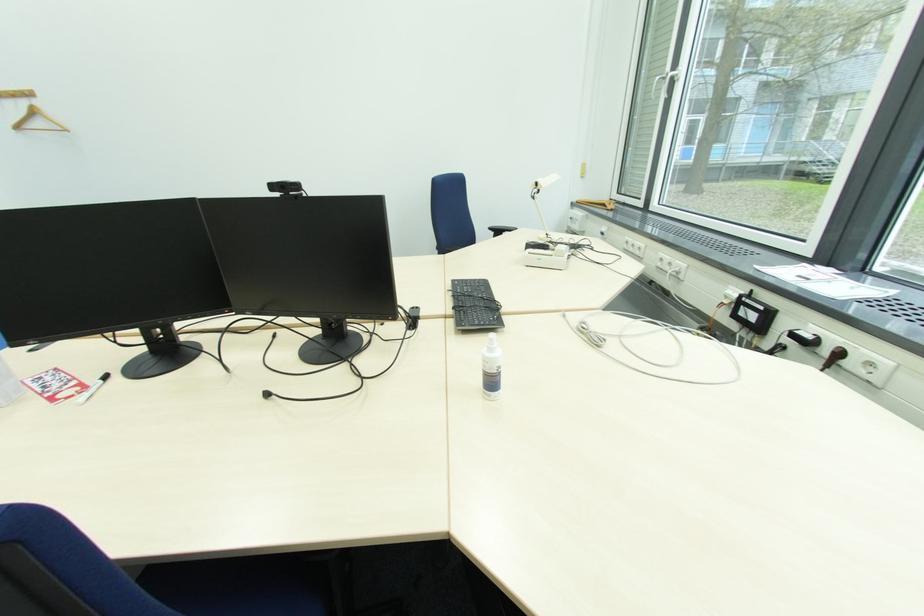
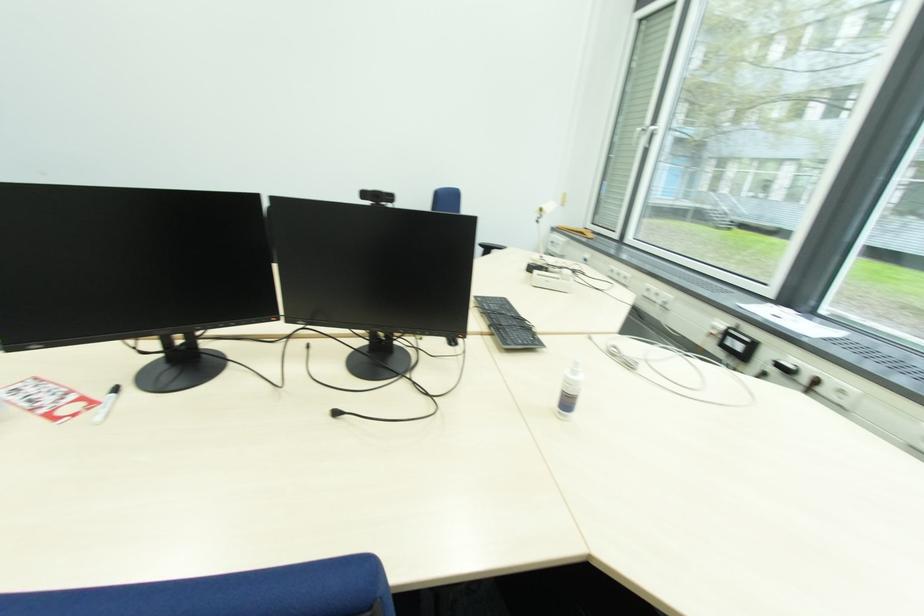
Locate, in the second image, the point that corresponds to point (476, 300) in the first image.

(506, 318)